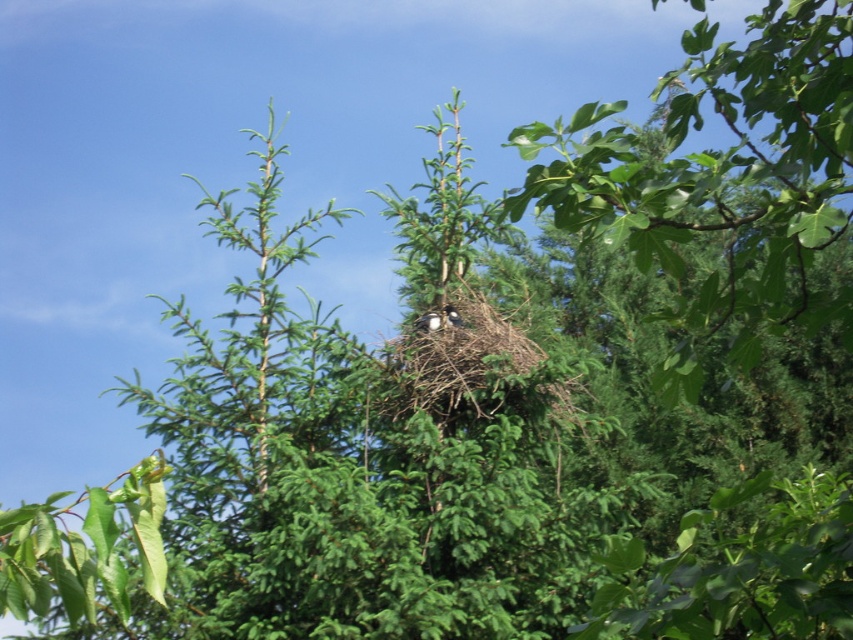
Question: Is white fluffy bird at center below brown fuzzy bird at center?

Choices:
 (A) no
 (B) yes

Answer: (B)

Question: Which point is farther to the camera?

Choices:
 (A) (415, 326)
 (B) (454, 326)

Answer: (A)

Question: Which point is farther to the camera?

Choices:
 (A) white fluffy bird at center
 (B) brown fuzzy bird at center

Answer: (A)

Question: Does white fluffy bird at center appear over brown fuzzy bird at center?

Choices:
 (A) yes
 (B) no

Answer: (B)

Question: Can you confirm if white fluffy bird at center is wider than brown fuzzy bird at center?

Choices:
 (A) yes
 (B) no

Answer: (A)